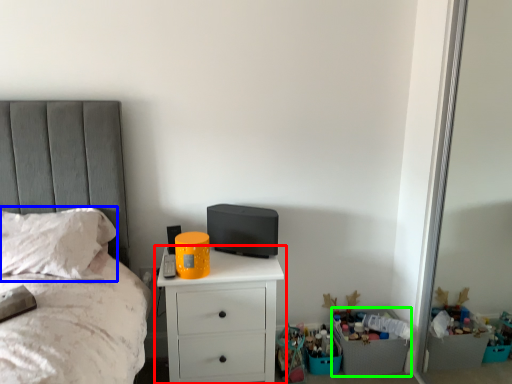
Question: Based on their relative distances, which object is farther from chest of drawers (highlighted by a red box)? Choose from pillow (highlighted by a blue box) and crate (highlighted by a green box).

Choices:
 (A) pillow
 (B) crate

Answer: (B)